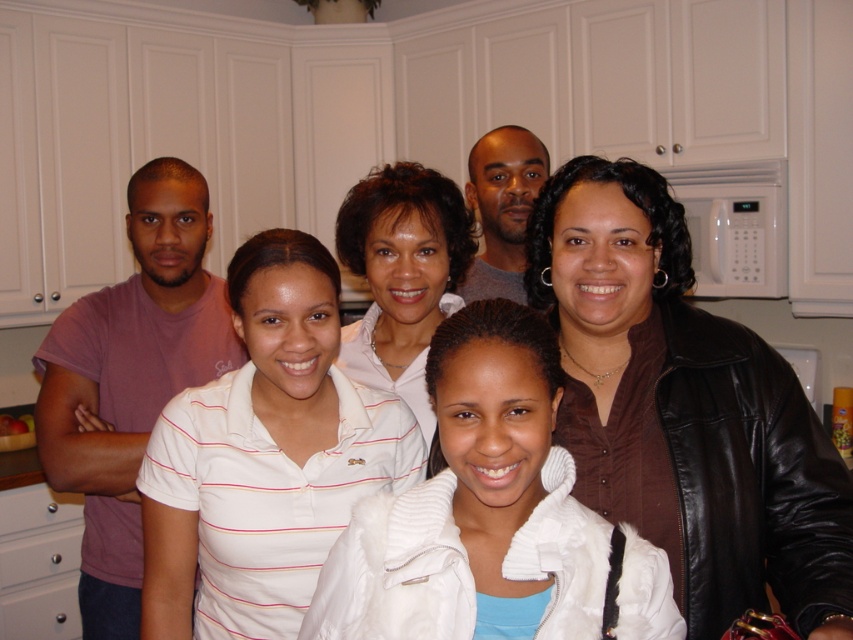
Does point (635, 214) come closer to viewer compared to point (523, 483)?

No.

Who is positioned more to the right, brown leather jacket at upper right or white fleece jacket at center?

From the viewer's perspective, brown leather jacket at upper right appears more on the right side.

This screenshot has height=640, width=853. What are the coordinates of `brown leather jacket at upper right` in the screenshot? It's located at (683, 406).

The image size is (853, 640). In order to click on white striped polo shirt at center in this screenshot , I will do `click(265, 456)`.

Is point (263, 436) positioned in front of point (419, 492)?

That is False.

You are a GUI agent. You are given a task and a screenshot of the screen. Output one action in this format:
    pyautogui.click(x=<x>, y=<y>)
    Task: Click on the white striped polo shirt at center
    This screenshot has width=853, height=640.
    Given the screenshot: What is the action you would take?
    pyautogui.click(x=265, y=456)

Between brown leather jacket at upper right and white striped polo shirt at center, which one is positioned lower?

white striped polo shirt at center is below.

Based on the photo, who is positioned more to the left, brown leather jacket at upper right or white striped polo shirt at center?

Positioned to the left is white striped polo shirt at center.

At what (x,y) coordinates should I click in order to perform the action: click on brown leather jacket at upper right. Please return your answer as a coordinate pair (x, y). This screenshot has height=640, width=853. Looking at the image, I should click on (683, 406).